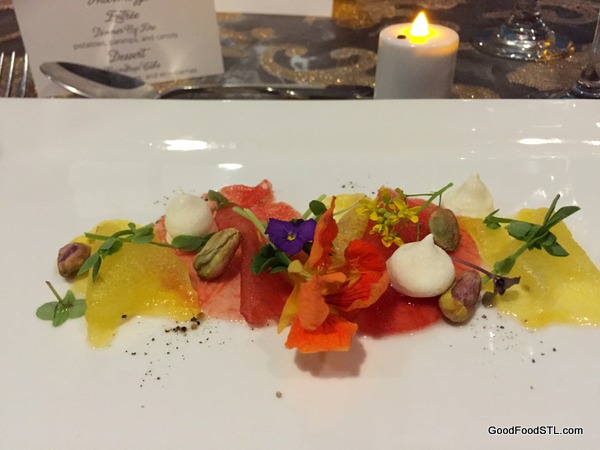
Find the location of `white plate`. white plate is located at coordinates (396, 135).